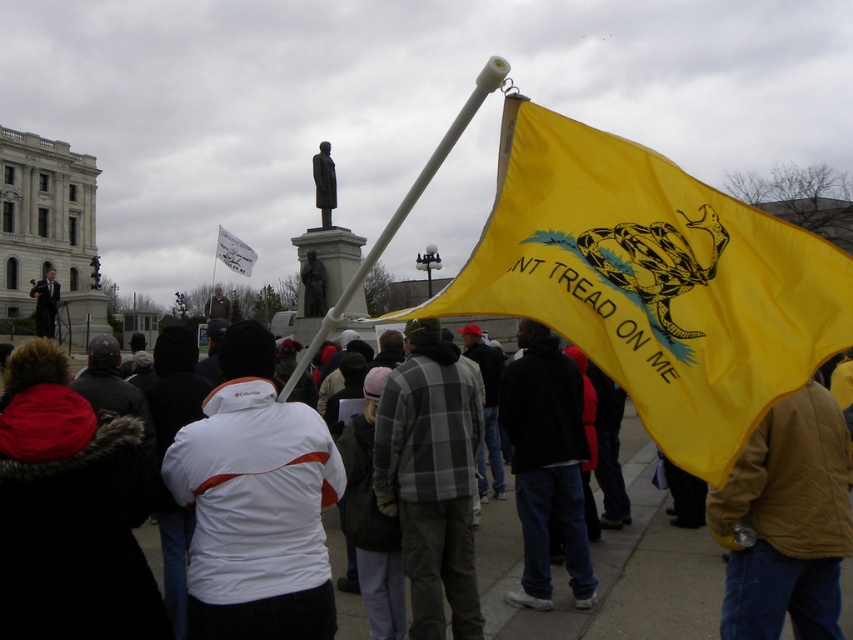
Question: From the image, what is the correct spatial relationship of brown leather jacket at lower right in relation to suit at center?

Choices:
 (A) above
 (B) below

Answer: (B)

Question: Which of these objects is positioned farthest from the brown leather jacket at lower right?

Choices:
 (A) suit at center
 (B) white fleece jacket at center
 (C) plaid fleece jacket at center
 (D) dark blue jeans at center

Answer: (A)

Question: Which point is farther to the camera?

Choices:
 (A) dark blue jeans at center
 (B) yellow fabric flag at center

Answer: (A)

Question: Can you confirm if plaid fleece jacket at center is positioned below white plastic flag pole at center?

Choices:
 (A) no
 (B) yes

Answer: (B)

Question: Which point appears closest to the camera in this image?

Choices:
 (A) (434, 172)
 (B) (57, 296)

Answer: (A)

Question: Does white plastic flag pole at center lie in front of white plastic flag at center?

Choices:
 (A) no
 (B) yes

Answer: (B)